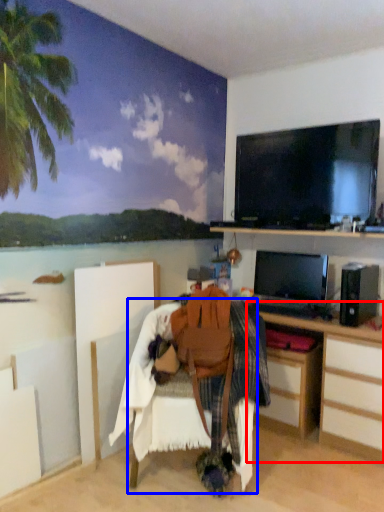
Question: Among these objects, which one is nearest to the camera, desk (highlighted by a red box) or chair (highlighted by a blue box)?

Choices:
 (A) desk
 (B) chair

Answer: (B)